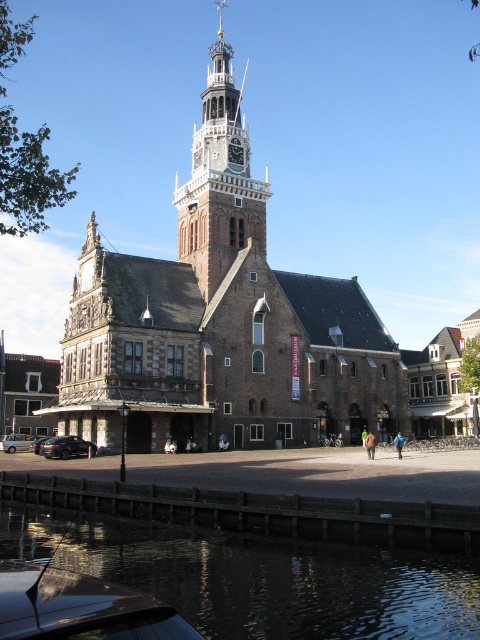
Question: Among these points, which one is farthest from the camera?

Choices:
 (A) (192, 536)
 (B) (242, 129)

Answer: (B)

Question: Among these points, which one is nearest to the camera?

Choices:
 (A) (111, 314)
 (B) (263, 246)
 (C) (85, 545)

Answer: (C)

Question: Is brown brick church at center thinner than dark reflective water at lower left?

Choices:
 (A) no
 (B) yes

Answer: (A)

Question: Can you confirm if brown brick church at center is thinner than dark reflective water at lower left?

Choices:
 (A) yes
 (B) no

Answer: (B)

Question: Observing the image, what is the correct spatial positioning of brown brick church at center in reference to wooden clock tower at center?

Choices:
 (A) left
 (B) right

Answer: (B)

Question: Which point is farther from the camera taking this photo?

Choices:
 (A) (265, 198)
 (B) (280, 545)

Answer: (A)